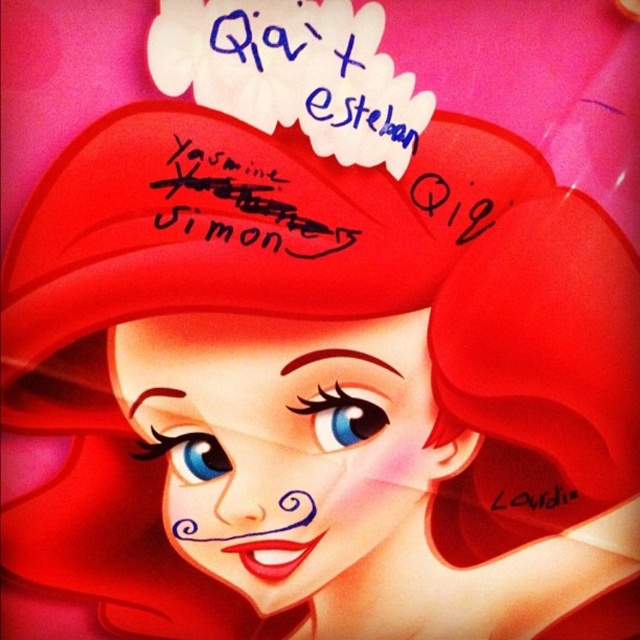
What are the coordinates of the blue ink signature at upper center?

The blue ink signature at upper center is located at coordinates point (310,77).

You are a photographer standing 5 feet away from the character. You want to take a closeup shot of the point at coordinates point (310, 556). Will you need to move closer or farther away to focus on that point?

The distance of point (310, 556) from camera is 4.97 feet, so you are currently 5 feet away. To focus on the point, you need to move slightly closer by about 0.03 feet to match the exact distance.

Based on the scene description, which object is taller between the matte red hair at center and the blue ink signature at upper center?

The matte red hair at center is taller than the blue ink signature at upper center according to the description.